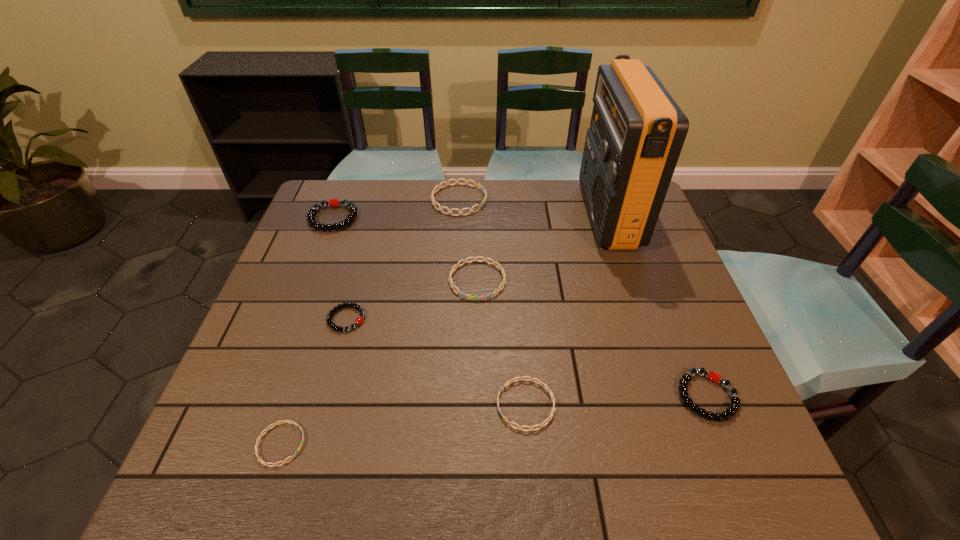
This screenshot has width=960, height=540. What are the coordinates of `the tallest object` in the screenshot? It's located at (637, 131).

Identify the location of the biggest blue bracelet. (480, 187).

Image resolution: width=960 pixels, height=540 pixels. I want to click on the biggest black bracelet, so click(x=335, y=202).

Locate an element on the screen. Image resolution: width=960 pixels, height=540 pixels. the farthest black bracelet is located at coordinates pos(335,202).

Identify the location of the fourth farthest object. This screenshot has width=960, height=540. (452, 271).

Where is `the fifth nearest bracelet`? This screenshot has width=960, height=540. the fifth nearest bracelet is located at coordinates (452, 271).

The height and width of the screenshot is (540, 960). Find the location of `the rightmost black bracelet`. the rightmost black bracelet is located at coordinates (714, 377).

Locate an element on the screen. The image size is (960, 540). the nearest black bracelet is located at coordinates (714, 377).

Where is `the third biggest blue bracelet`? The image size is (960, 540). the third biggest blue bracelet is located at coordinates (509, 382).

Find the location of a particular element. The height and width of the screenshot is (540, 960). the fourth farthest bracelet is located at coordinates tap(359, 320).